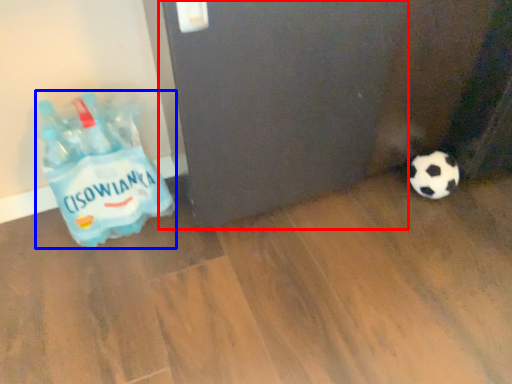
Question: Which point is further to the camera, screen door (highlighted by a red box) or bottle (highlighted by a blue box)?

Choices:
 (A) screen door
 (B) bottle

Answer: (B)